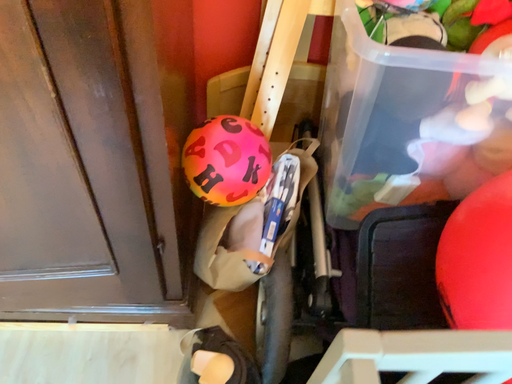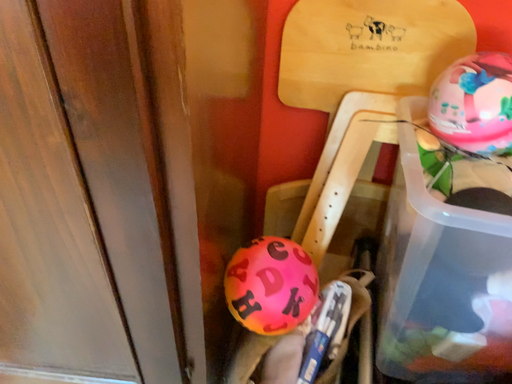
Question: How did the camera likely rotate when shooting the video?

Choices:
 (A) rotated left
 (B) rotated right

Answer: (A)